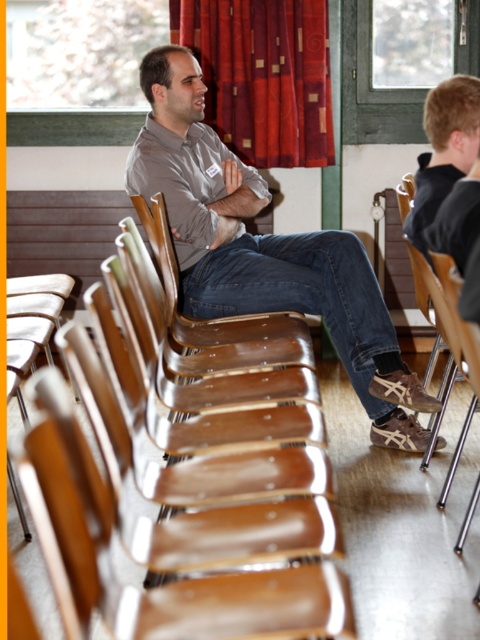
You are standing at the entrance of the room and see the brown leather shoes at center and the black fabric shirt at right. Which object is positioned closer to the right side of the room?

The black fabric shirt at right is positioned closer to the right side of the room because the brown leather shoes at center are to the left of it.